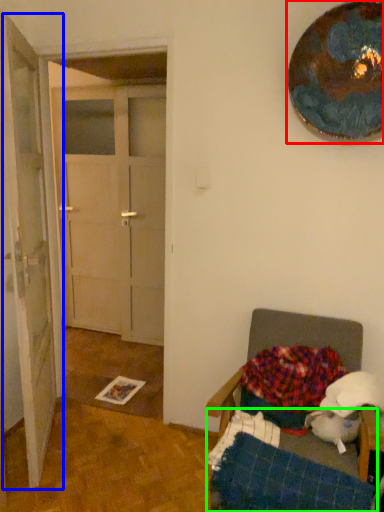
Question: Based on their relative distances, which object is nearer to oval (highlighted by a red box)? Choose from door (highlighted by a blue box) and bed frame (highlighted by a green box).

Choices:
 (A) door
 (B) bed frame

Answer: (A)